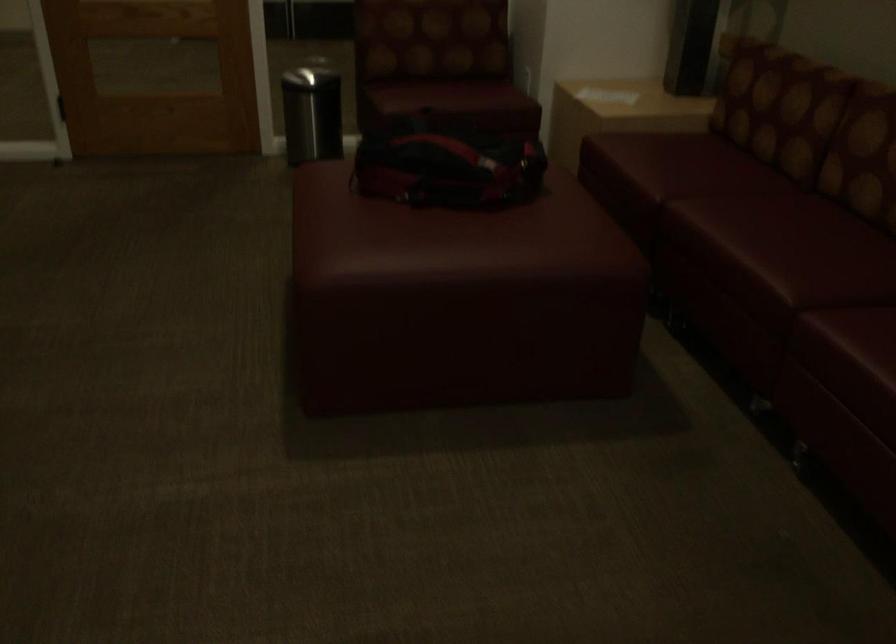
I want to click on red sofa sitting surface, so click(736, 240).